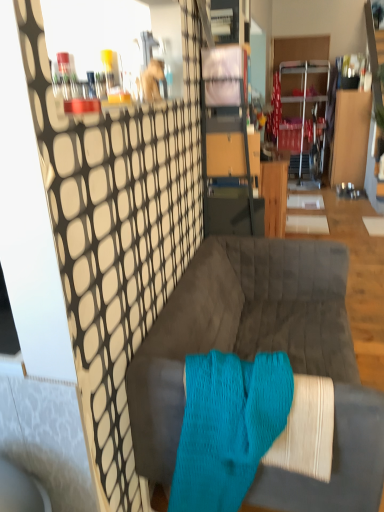
Question: Is the position of velvet gray couch at center less distant than that of aqua knitted sock at center?

Choices:
 (A) yes
 (B) no

Answer: (B)

Question: Considering the relative sizes of velvet gray couch at center and aqua knitted sock at center in the image provided, is velvet gray couch at center smaller than aqua knitted sock at center?

Choices:
 (A) no
 (B) yes

Answer: (A)

Question: Is aqua knitted sock at center surrounded by velvet gray couch at center?

Choices:
 (A) no
 (B) yes

Answer: (B)

Question: From a real-world perspective, is velvet gray couch at center under aqua knitted sock at center?

Choices:
 (A) no
 (B) yes

Answer: (B)

Question: Can you confirm if velvet gray couch at center is taller than aqua knitted sock at center?

Choices:
 (A) yes
 (B) no

Answer: (A)

Question: Based on their positions, is wooden table at center located to the left or right of velvet gray couch at center?

Choices:
 (A) left
 (B) right

Answer: (B)

Question: Is wooden table at center inside or outside of velvet gray couch at center?

Choices:
 (A) inside
 (B) outside

Answer: (B)

Question: Considering the positions of wooden table at center and velvet gray couch at center in the image, is wooden table at center taller or shorter than velvet gray couch at center?

Choices:
 (A) short
 (B) tall

Answer: (B)

Question: Does point (263, 188) appear closer or farther from the camera than point (175, 384)?

Choices:
 (A) farther
 (B) closer

Answer: (A)

Question: Relative to velvet gray couch at center, is aqua knitted sock at center in front or behind?

Choices:
 (A) front
 (B) behind

Answer: (A)

Question: From the image's perspective, is aqua knitted sock at center above or below velvet gray couch at center?

Choices:
 (A) below
 (B) above

Answer: (A)

Question: Is point (233, 371) closer or farther from the camera than point (236, 297)?

Choices:
 (A) closer
 (B) farther

Answer: (A)

Question: Considering the positions of aqua knitted sock at center and velvet gray couch at center in the image, is aqua knitted sock at center taller or shorter than velvet gray couch at center?

Choices:
 (A) tall
 (B) short

Answer: (B)

Question: From their relative heights in the image, would you say velvet gray couch at center is taller or shorter than aqua knitted sock at center?

Choices:
 (A) short
 (B) tall

Answer: (B)

Question: Considering the positions of velvet gray couch at center and aqua knitted sock at center in the image, is velvet gray couch at center wider or thinner than aqua knitted sock at center?

Choices:
 (A) thin
 (B) wide

Answer: (B)